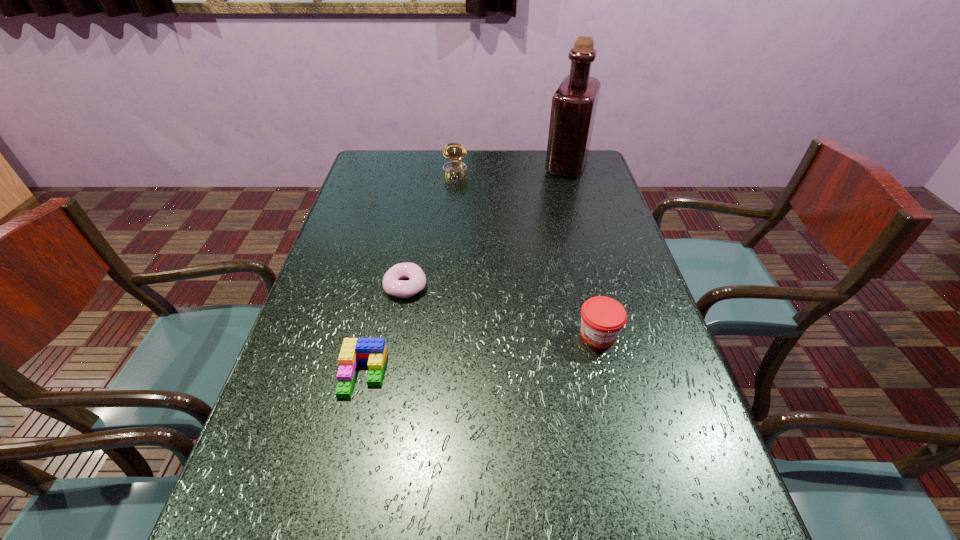
Identify the location of vacant region at the far edge of the desktop. (532, 182).

The image size is (960, 540). In the image, there is a desktop. What are the coordinates of `vacant space at the left edge` in the screenshot? It's located at (366, 225).

This screenshot has width=960, height=540. What are the coordinates of `blank space at the right edge of the desktop` in the screenshot? It's located at (608, 219).

The height and width of the screenshot is (540, 960). Find the location of `vacant space at the far left corner of the desktop`. vacant space at the far left corner of the desktop is located at coordinates (375, 164).

Identify the location of vacant space that is in between the Lego and the shortest object. (384, 330).

In order to click on vacant area that lies between the jam and the compass in this screenshot , I will do `click(527, 254)`.

You are a GUI agent. You are given a task and a screenshot of the screen. Output one action in this format:
    pyautogui.click(x=<x>, y=<y>)
    Task: Click on the blank region between the shortest object and the fourth farthest object
    
    Given the screenshot: What is the action you would take?
    pyautogui.click(x=502, y=310)

Where is `empty location between the tallest object and the third nearest object`? Image resolution: width=960 pixels, height=540 pixels. empty location between the tallest object and the third nearest object is located at coordinates (486, 226).

Identify which object is the second nearest to the jam. Please provide its 2D coordinates. Your answer should be formatted as a tuple, i.e. [(x, y)], where the tuple contains the x and y coordinates of a point satisfying the conditions above.

[(372, 351)]

Identify which object is located as the third nearest to the tallest object. Please provide its 2D coordinates. Your answer should be formatted as a tuple, i.e. [(x, y)], where the tuple contains the x and y coordinates of a point satisfying the conditions above.

[(602, 318)]